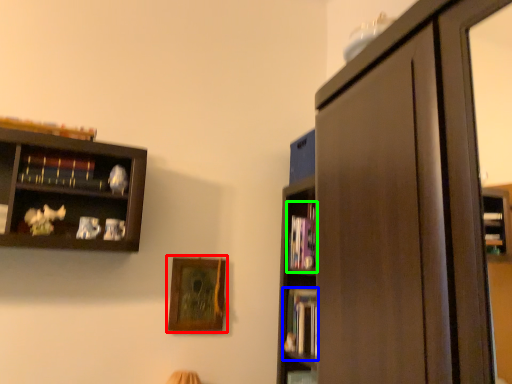
Question: Which object is the farthest from picture frame (highlighted by a red box)? Choose among these: book (highlighted by a blue box) or book (highlighted by a green box).

Choices:
 (A) book
 (B) book

Answer: (B)